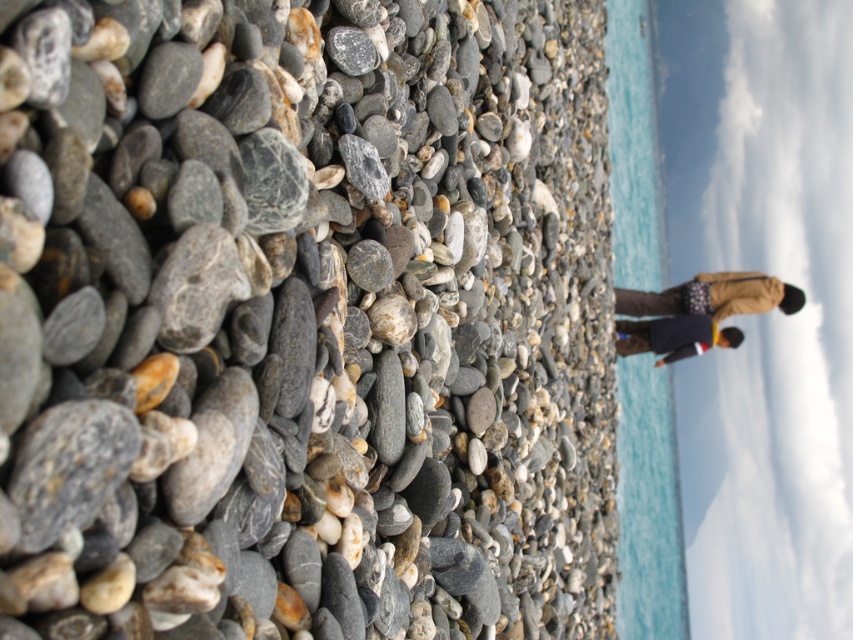
Find the location of `brown fabric jacket at right`. brown fabric jacket at right is located at coordinates (712, 296).

Which is behind, point (717, 289) or point (685, 316)?

The point (717, 289) is behind.

The image size is (853, 640). In order to click on brown fabric jacket at right in this screenshot , I will do `click(712, 296)`.

Does smooth gray pebble at center have a smaller size compared to blue water at center?

Yes, smooth gray pebble at center is smaller than blue water at center.

Between smooth gray pebble at center and blue water at center, which one is positioned higher?

Positioned higher is blue water at center.

The image size is (853, 640). I want to click on smooth gray pebble at center, so click(305, 321).

Is smooth gray pebble at center smaller than brown fabric jacket at right?

Actually, smooth gray pebble at center might be larger than brown fabric jacket at right.

Who is more forward, (184, 618) or (796, 308)?

Point (184, 618) is in front.

You are a GUI agent. You are given a task and a screenshot of the screen. Output one action in this format:
    pyautogui.click(x=<x>, y=<y>)
    Task: Click on the smooth gray pebble at center
    This screenshot has height=640, width=853.
    Given the screenshot: What is the action you would take?
    pyautogui.click(x=305, y=321)